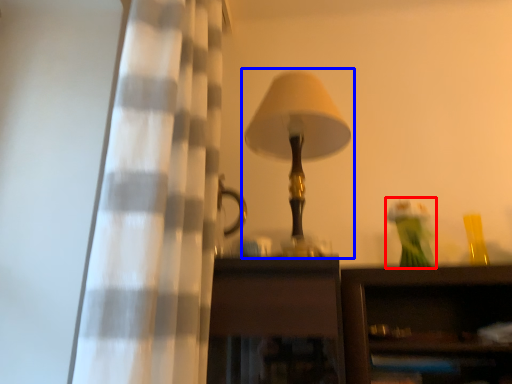
Question: Which object is further to the camera taking this photo, toy (highlighted by a red box) or lamp (highlighted by a blue box)?

Choices:
 (A) toy
 (B) lamp

Answer: (A)